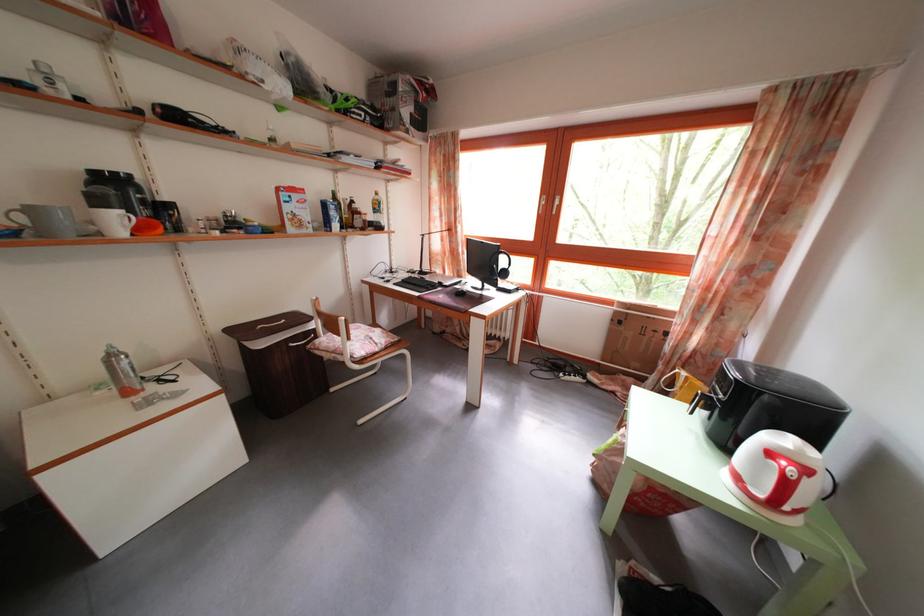
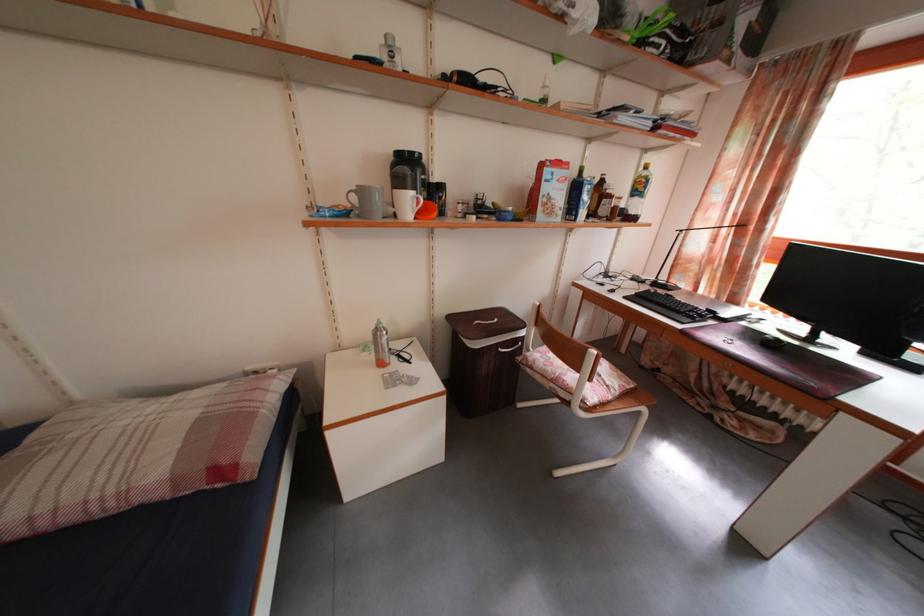
Where in the second image is the point corresponding to (101,235) from the first image?

(398, 217)